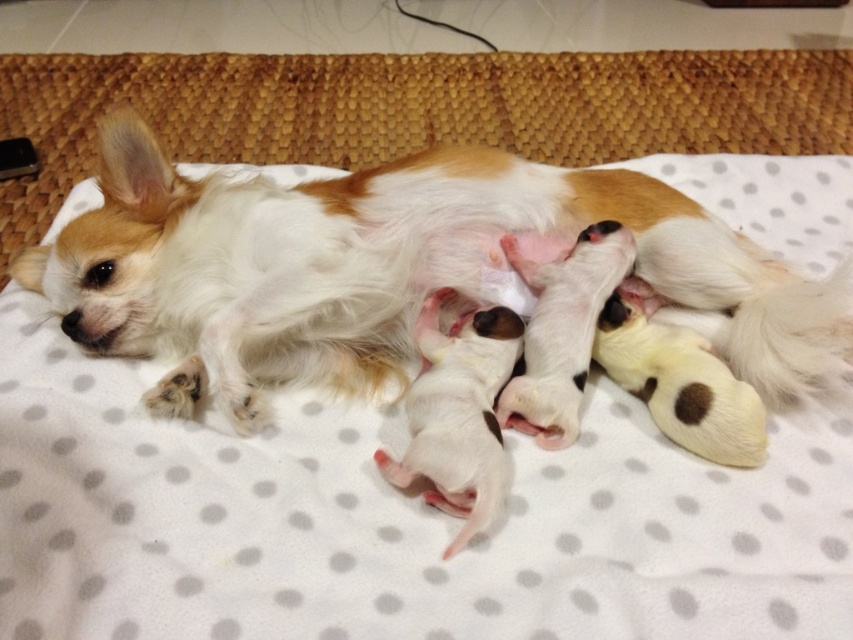
Between point (190, 234) and point (425, 460), which one is positioned behind?

The point (190, 234) is behind.

Can you confirm if white fur dog at center is positioned to the right of white soft puppies at center?

In fact, white fur dog at center is to the left of white soft puppies at center.

Between point (271, 280) and point (427, 323), which one is positioned in front?

Positioned in front is point (271, 280).

Where is `white fur dog at center`? white fur dog at center is located at coordinates (386, 268).